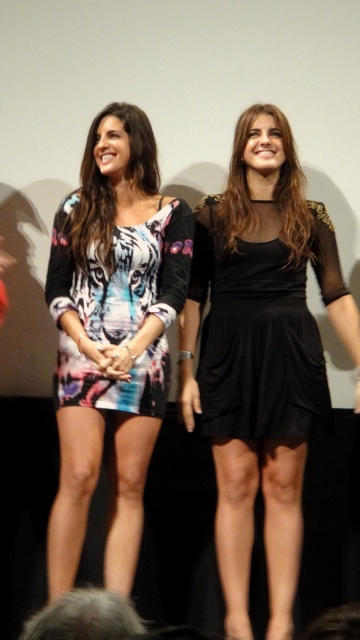
Based on the photo, you are a photographer at a fashion show. You need to place a black velvet dress at center on a mannequin. The mannequin is currently at point [261,362]. Where should you place the mannequin to position the black velvet dress at center correctly?

The black velvet dress at center should be placed exactly at point [261,362] as that is where the dress is located.

You are a photographer at a fashion show. You need to arrange two models wearing the black velvet dress at center and the printed fabric dress at center so that the taller dress is in front to avoid being blocked by the shorter one. Which dress should be placed in front?

The black velvet dress at center is taller than the printed fabric dress at center, so the black velvet dress at center should be placed in front to avoid blocking the shorter printed fabric dress at center.

Consider the image. You are a photographer at a fashion show. You have two models wearing the black velvet dress at center and the black sheer dress at center. You need to arrange them so that the larger dress is visible to the audience. Which dress should be placed closer to the front?

The black velvet dress at center is larger in size than the black sheer dress at center, so placing it closer to the front will ensure its size is more visible to the audience.